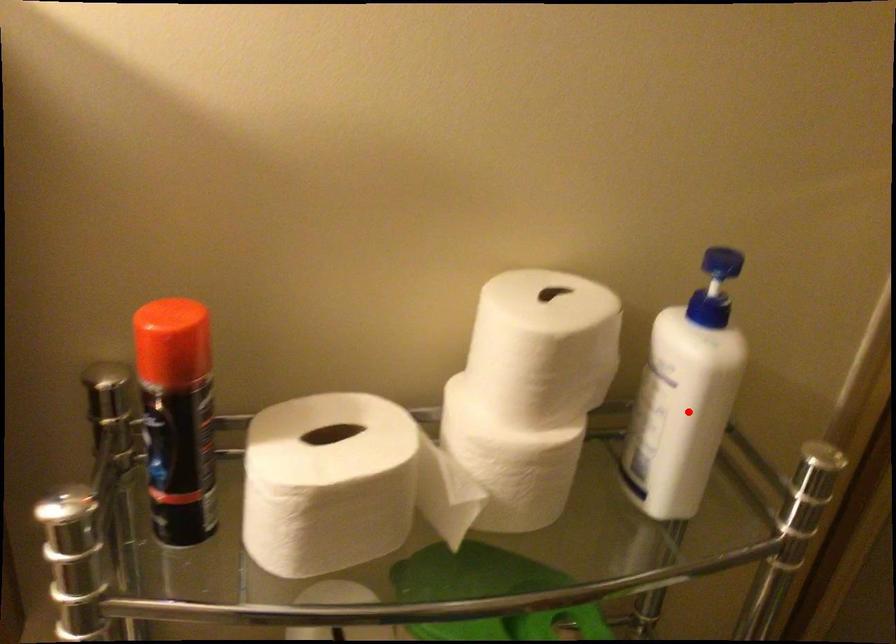
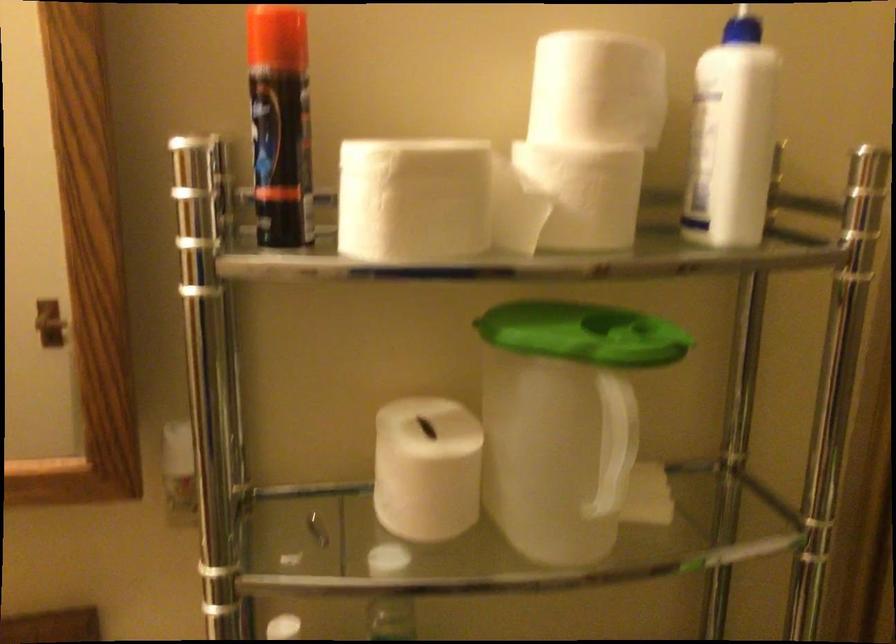
Question: I am providing you with two images of the same scene from different viewpoints. Image1 has a red point marked. In image2, the corresponding 3D location appears at what relative position? Reply with the corresponding letter.

Choices:
 (A) Closer
 (B) Farther

Answer: (B)